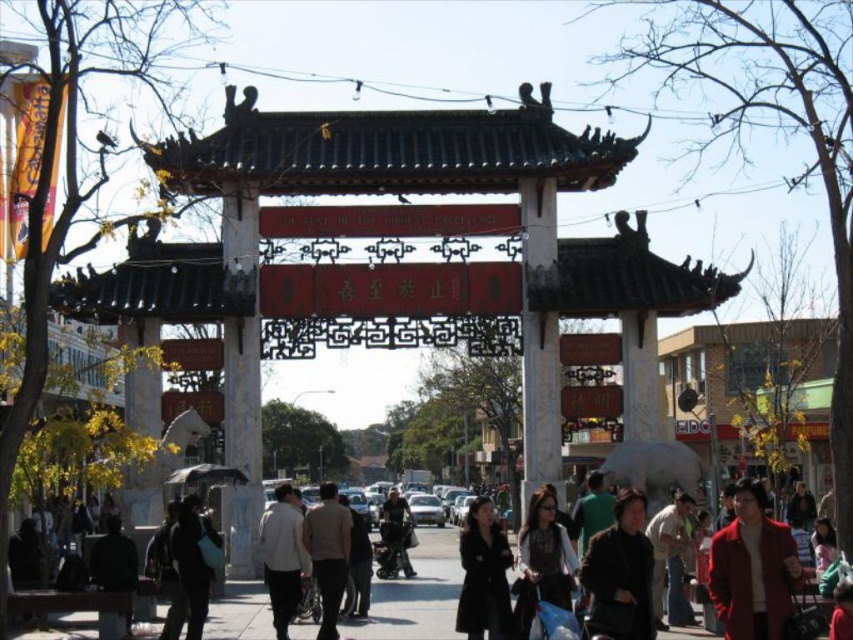
Question: Considering the relative positions of dark brown leather jacket at lower right and dark brown leather jacket at center in the image provided, where is dark brown leather jacket at lower right located with respect to dark brown leather jacket at center?

Choices:
 (A) right
 (B) left

Answer: (A)

Question: Does dark gray coat at center have a lesser width compared to dark gray fabric stroller at center?

Choices:
 (A) no
 (B) yes

Answer: (A)

Question: Among these objects, which one is nearest to the camera?

Choices:
 (A) matte red coat at center
 (B) dark gray coat at center
 (C) dark brown leather jacket at lower right

Answer: (C)

Question: Among these objects, which one is nearest to the camera?

Choices:
 (A) matte red coat at center
 (B) dark brown leather jacket at center

Answer: (A)

Question: Among these objects, which one is nearest to the camera?

Choices:
 (A) light gray fabric jacket at lower center
 (B) black matte coat at center

Answer: (B)

Question: Is dark brown leather jacket at lower right thinner than dark brown leather jacket at center?

Choices:
 (A) yes
 (B) no

Answer: (B)